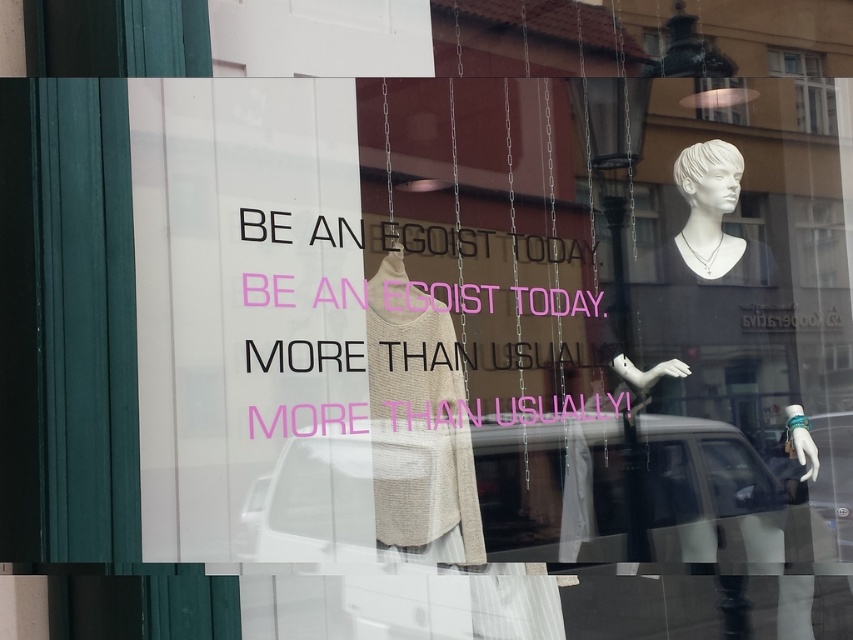
Question: Which point is farther to the camera?

Choices:
 (A) (737, 118)
 (B) (804, 96)
 (C) (752, 260)

Answer: (B)

Question: Does transparent glass at upper center appear on the right side of matte black hat at upper center?

Choices:
 (A) no
 (B) yes

Answer: (B)

Question: Where is white porcelain bust at upper right located in relation to matte black hat at upper center in the image?

Choices:
 (A) below
 (B) above

Answer: (A)

Question: Which object is closer to the camera taking this photo?

Choices:
 (A) beige knitted sweater at center
 (B) matte black hat at upper center
 (C) transparent glass at upper center
 (D) white porcelain bust at upper right

Answer: (A)

Question: Which of these objects is positioned farthest from the transparent glass at upper center?

Choices:
 (A) matte black hat at upper center
 (B) white porcelain bust at upper right

Answer: (B)

Question: Does transparent glass at upper center appear on the left side of matte black hat at upper center?

Choices:
 (A) yes
 (B) no

Answer: (B)